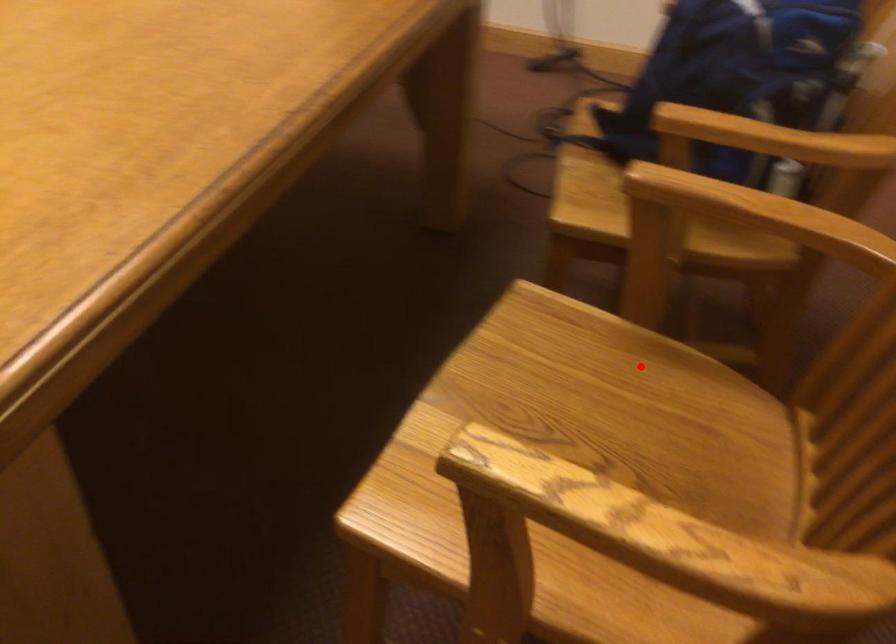
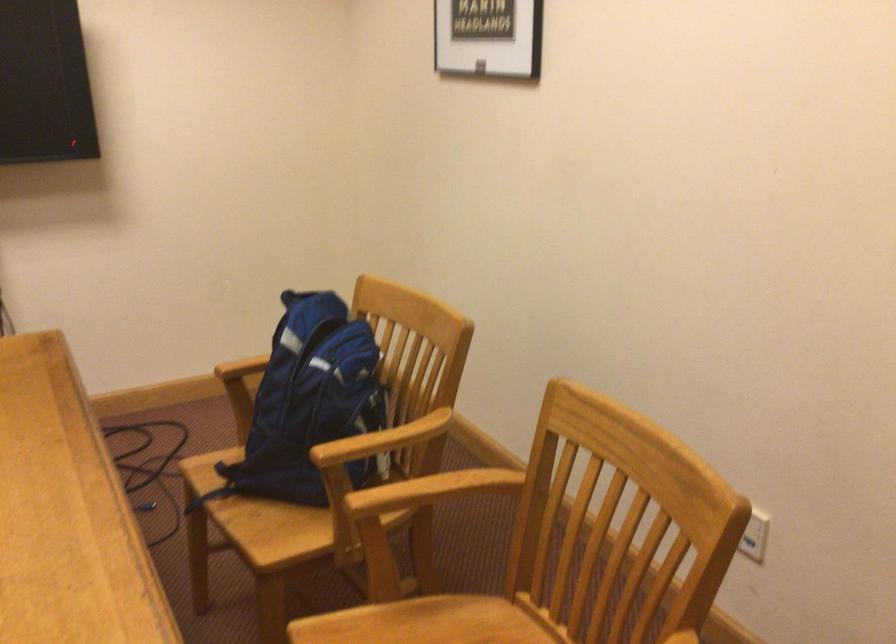
Question: I am providing you with two images of the same scene from different viewpoints. A red point is marked on the first image. Is the red point's position out of view in image 2?

Choices:
 (A) Yes
 (B) No

Answer: (B)